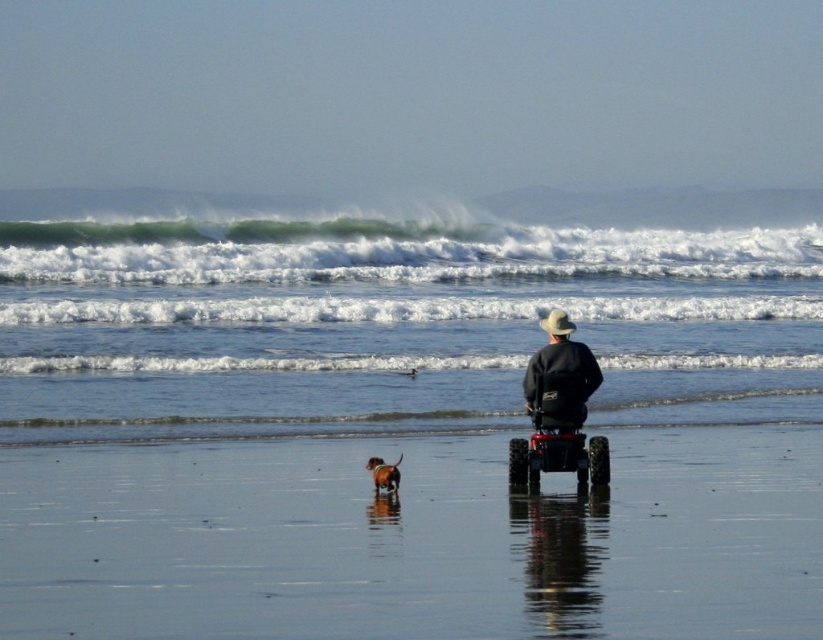
You are a photographer standing on the beach. You want to capture a photo of the black rubber wheelchair at center and the white frothy wave at upper center in the same frame. Which object will appear larger in the photo?

The white frothy wave at upper center will appear larger in the photo because it is much taller than the black rubber wheelchair at center.

You are a photographer trying to capture a photo of the matte black jacket at center and the brown furry dog at center. If you want to ensure both subjects are fully visible in the frame, which subject should you focus on to account for their size difference?

The matte black jacket at center is wider than the brown furry dog at center, so focusing on the matte black jacket at center ensures both subjects are fully visible in the frame due to its larger size.